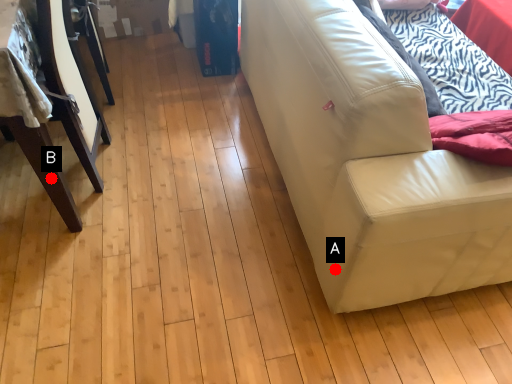
Question: Two points are circled on the image, labeled by A and B beside each circle. Which point is closer to the camera?

Choices:
 (A) A is closer
 (B) B is closer

Answer: (A)